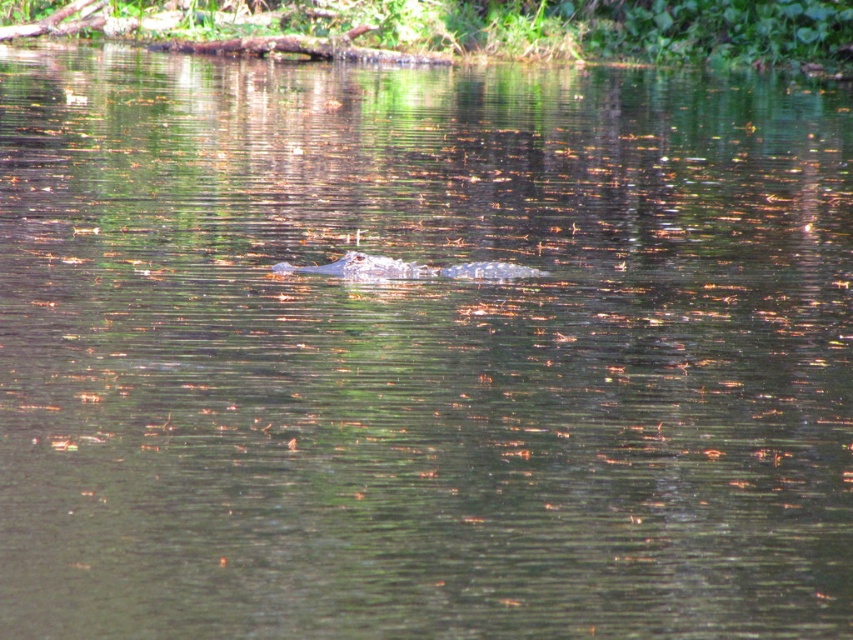
Locate an element on the screen. The image size is (853, 640). green leafy vegetation at upper center is located at coordinates (469, 28).

Can you confirm if green leafy vegetation at upper center is bigger than grayish-green scaly crocodile at center?

Yes.

Does point (694, 40) come in front of point (490, 273)?

No.

Identify the location of green leafy vegetation at upper center. (469, 28).